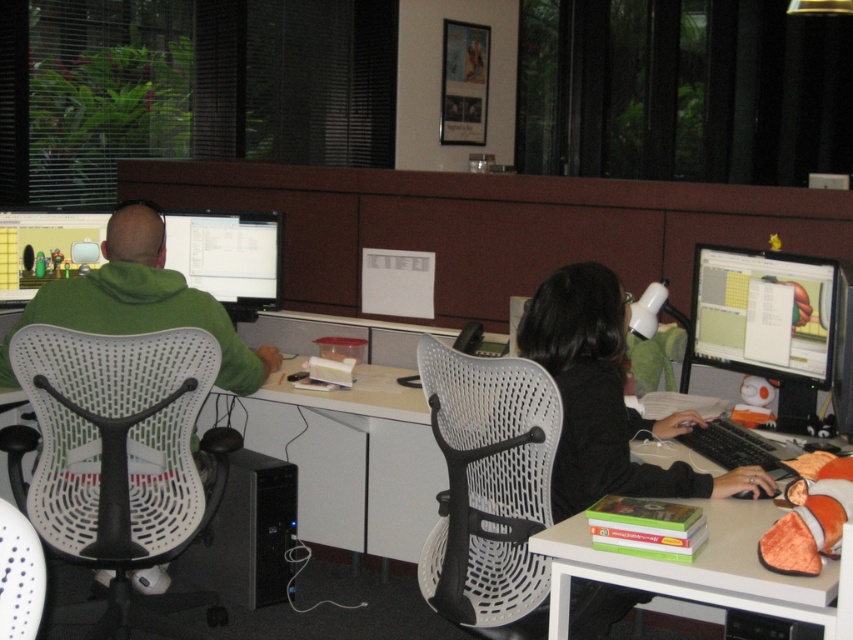
Question: Which of the following is the farthest from the observer?

Choices:
 (A) matte black monitor at center
 (B) white mesh swivel chair at left

Answer: (A)

Question: Which point is closer to the camera taking this photo?

Choices:
 (A) (160, 492)
 (B) (264, 228)
 (C) (784, 308)

Answer: (C)

Question: Among these objects, which one is farthest from the camera?

Choices:
 (A) white mesh swivel chair at center
 (B) white mesh swivel chair at left

Answer: (B)

Question: Is matte black monitor at center thinner than matte black monitor at upper left?

Choices:
 (A) yes
 (B) no

Answer: (B)

Question: Does white plastic table at lower right have a larger size compared to matte black monitor at upper left?

Choices:
 (A) no
 (B) yes

Answer: (B)

Question: Is white plastic table at lower right bigger than matte plastic monitor at right?

Choices:
 (A) yes
 (B) no

Answer: (A)